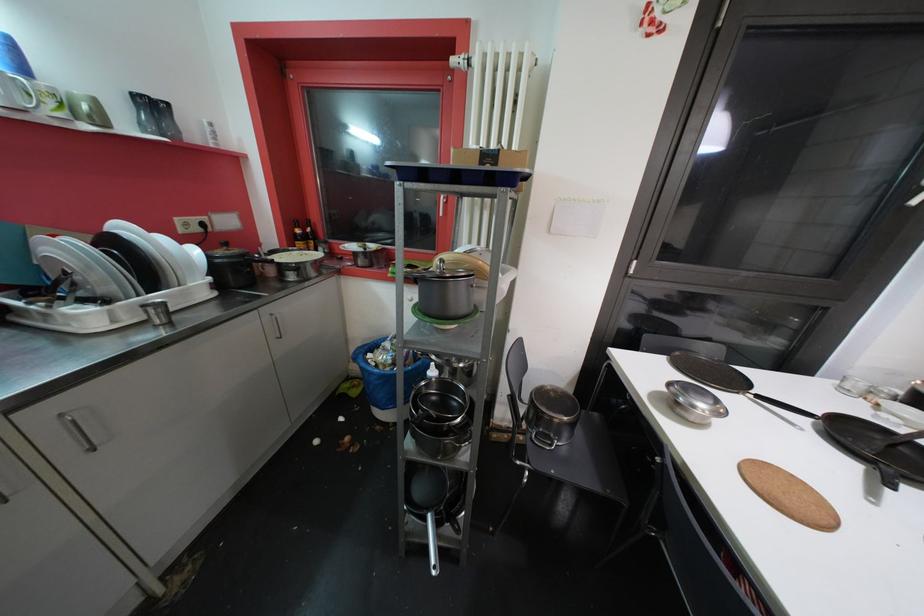
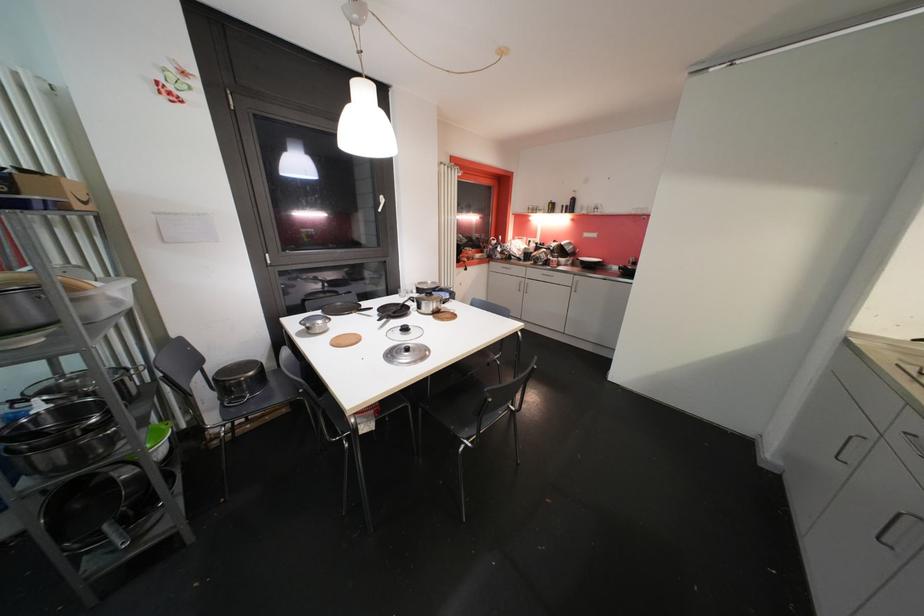
Question: The first image is from the beginning of the video and the second image is from the end. How did the camera likely rotate when shooting the video?

Choices:
 (A) Left
 (B) Right
 (C) Up
 (D) Down

Answer: (B)